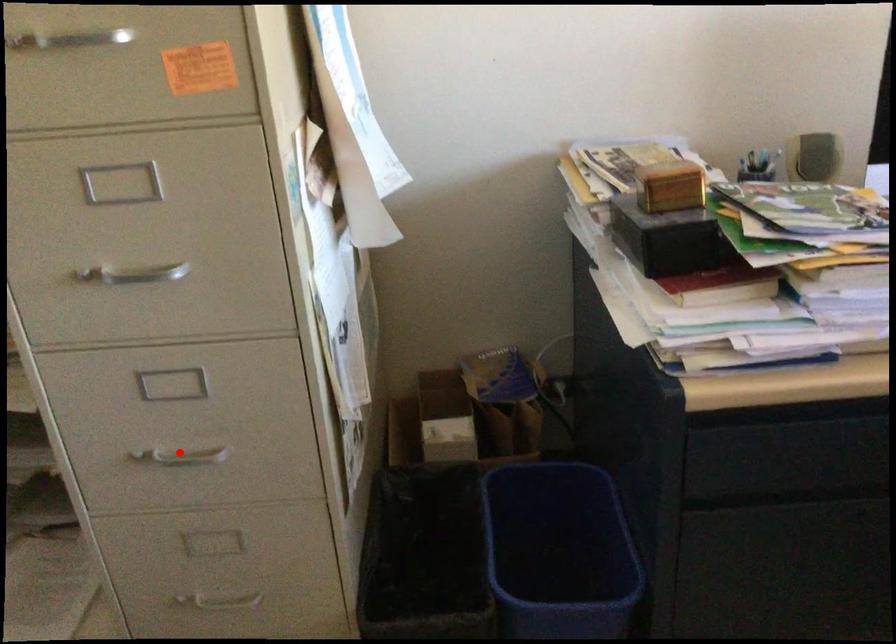
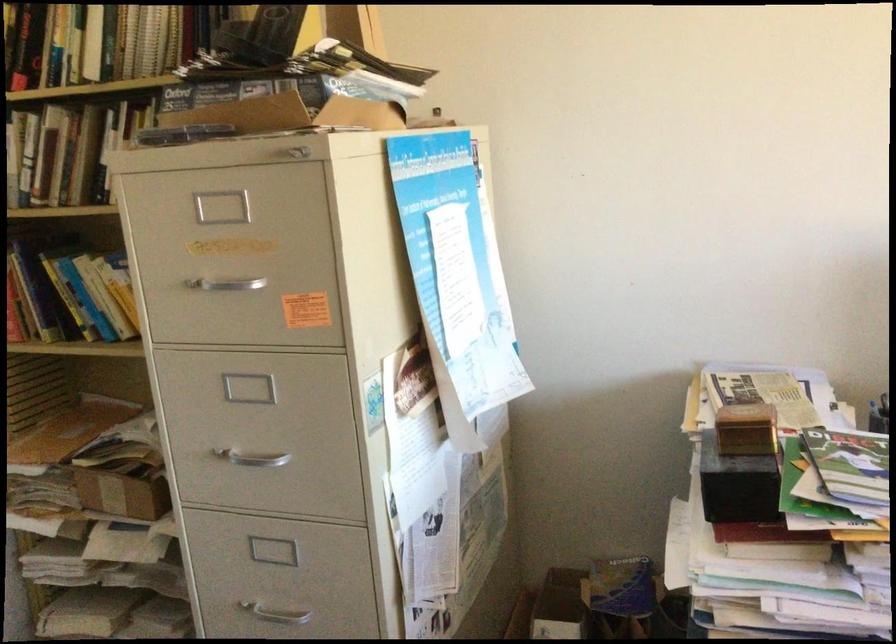
Find the pixel in the second image that matches the highlighted location in the first image.

(273, 608)